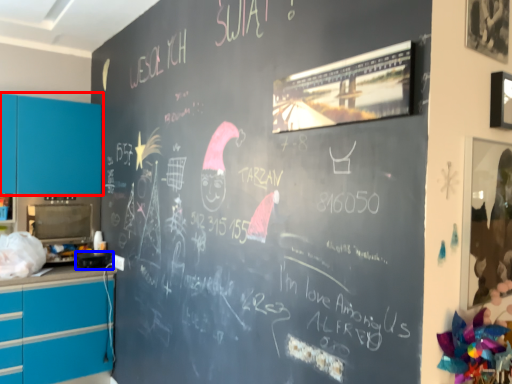
Question: Which object appears closest to the camera in this image, cabinetry (highlighted by a red box) or appliance (highlighted by a blue box)?

Choices:
 (A) cabinetry
 (B) appliance

Answer: (B)